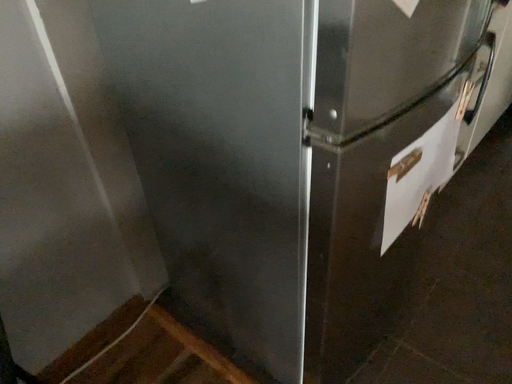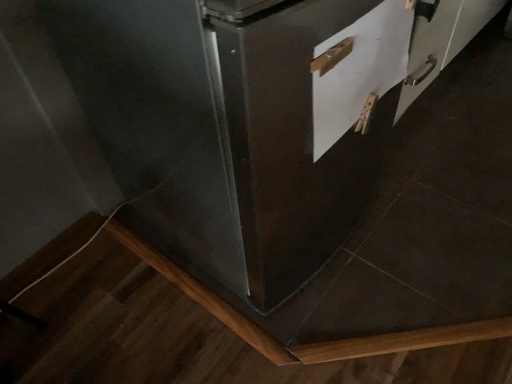
Question: How did the camera likely rotate when shooting the video?

Choices:
 (A) rotated upward
 (B) rotated downward

Answer: (B)